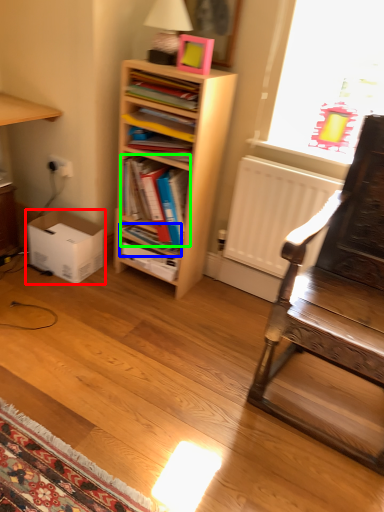
Question: Estimate the real-world distances between objects in this image. Which object is farther from box (highlighted by a red box), book (highlighted by a blue box) or book (highlighted by a green box)?

Choices:
 (A) book
 (B) book

Answer: (B)